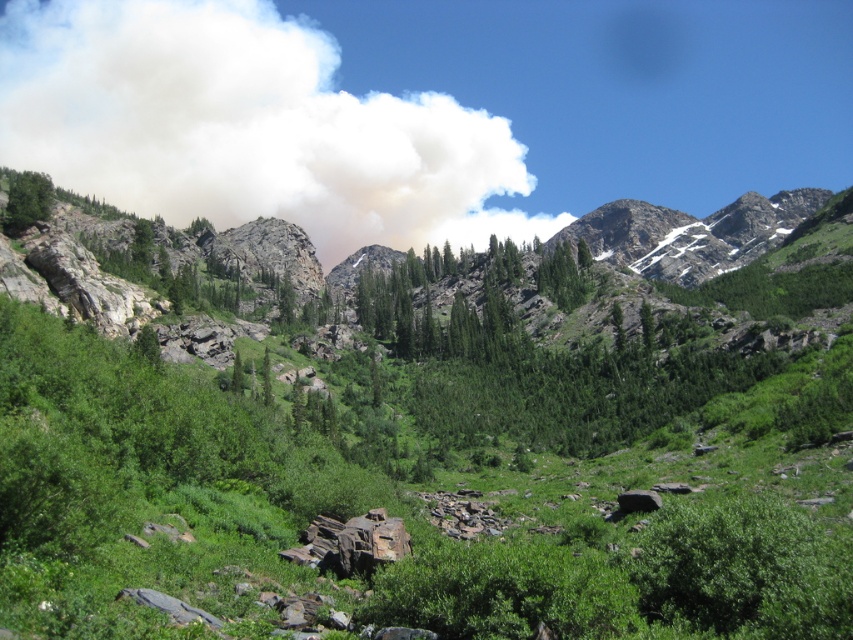
In the scene shown: You are an environmental scientist assessing air quality. You observe the white smoke at upper center and the green matte tree at upper left in the scene. Which of these two objects is more likely to indicate potential pollution?

The white smoke at upper center is more likely to indicate potential pollution because it has a larger size compared to the green matte tree at upper left, suggesting it could be a visible emission source.

You are a hiker planning to navigate the mountain path. You notice the white smoke at upper center and the green matte tree at upper left in the distance. Which object would you encounter first if you start climbing upwards from the valley?

You would encounter the white smoke at upper center first because it is closer to you than the green matte tree at upper left, which is further away in the background.

You are a hiker in the valley and notice two landmarks in the distance. You see the white smoke at upper center and the green matte tree at upper left. Which one is positioned more to the left side of your view?

The white smoke at upper center is to the left of the green matte tree at upper left, so the white smoke at upper center is positioned more to the left side of your view.